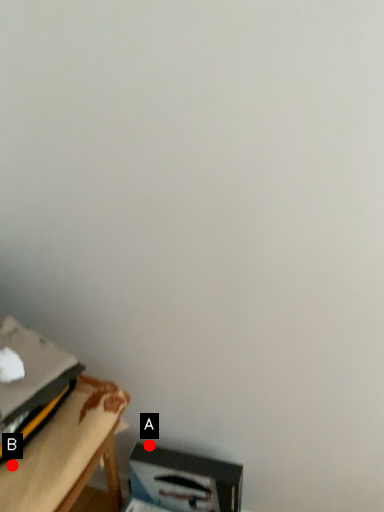
Question: Two points are circled on the image, labeled by A and B beside each circle. Which of the following is the farthest from the observer?

Choices:
 (A) A is further
 (B) B is further

Answer: (A)